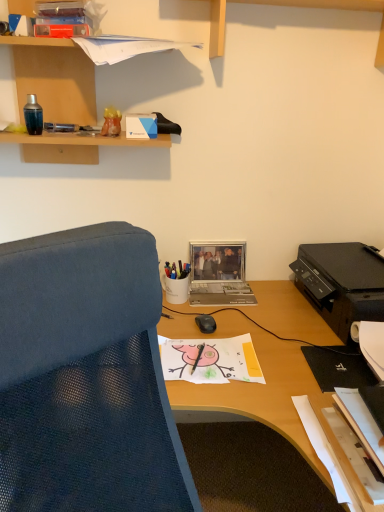
At what (x,y) coordinates should I click in order to perform the action: click on vacant area that is situated to the right of black matte pen at center, which is the second pen from left to right. Please return your answer as a coordinate pair (x, y). The height and width of the screenshot is (512, 384). Looking at the image, I should click on (236, 361).